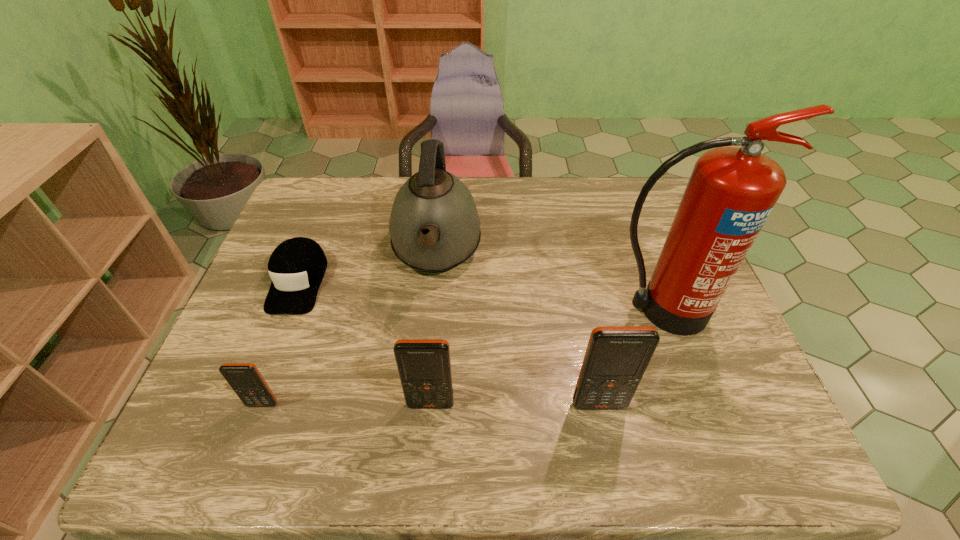
At what (x,y) coordinates should I click in order to perform the action: click on the leftmost cellular telephone. Please return your answer as a coordinate pair (x, y). The width and height of the screenshot is (960, 540). Looking at the image, I should click on (245, 379).

The width and height of the screenshot is (960, 540). I want to click on the second shortest object, so click(245, 379).

Locate an element on the screen. Image resolution: width=960 pixels, height=540 pixels. the second shortest cellular telephone is located at coordinates (424, 365).

Find the location of a particular element. the second cellular telephone from left to right is located at coordinates (424, 365).

You are a GUI agent. You are given a task and a screenshot of the screen. Output one action in this format:
    pyautogui.click(x=<x>, y=<y>)
    Task: Click on the rightmost cellular telephone
    
    Given the screenshot: What is the action you would take?
    pyautogui.click(x=616, y=358)

Identify the location of the fifth shortest object. The image size is (960, 540). (434, 225).

The width and height of the screenshot is (960, 540). I want to click on the shortest object, so click(297, 266).

The height and width of the screenshot is (540, 960). Find the location of `the tallest object`. the tallest object is located at coordinates (731, 192).

You are a GUI agent. You are given a task and a screenshot of the screen. Output one action in this format:
    pyautogui.click(x=<x>, y=<y>)
    Task: Click on the fire extinguisher
    This screenshot has height=540, width=960.
    Given the screenshot: What is the action you would take?
    pyautogui.click(x=731, y=192)

Identify the location of vacant space located at the spout of the second tallest object. This screenshot has width=960, height=540. (425, 357).